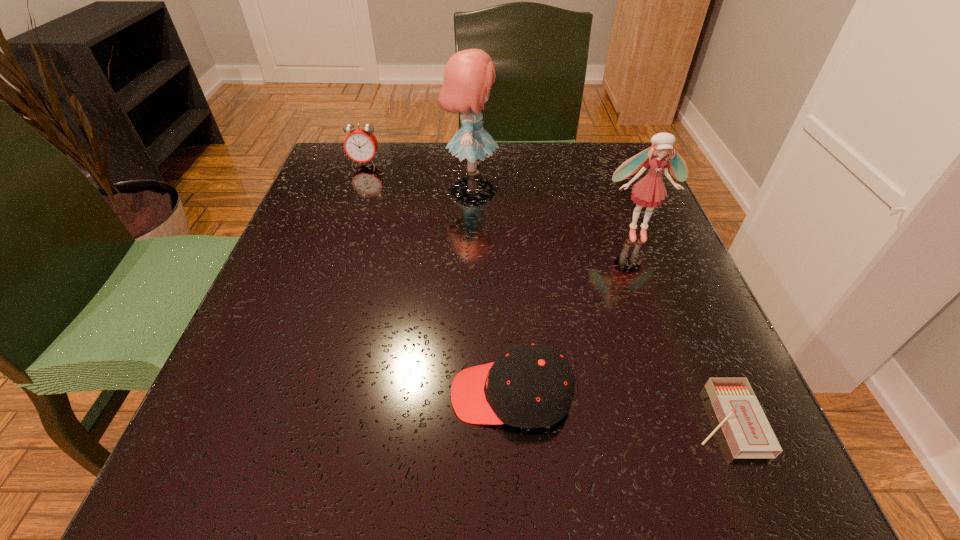
Find the location of a particular element. The width and height of the screenshot is (960, 540). object located in the left edge section of the desktop is located at coordinates (360, 145).

Image resolution: width=960 pixels, height=540 pixels. Identify the location of doll located at the right edge. (650, 191).

You are a GUI agent. You are given a task and a screenshot of the screen. Output one action in this format:
    pyautogui.click(x=<x>, y=<y>)
    Task: Click on the matchbox that is at the right edge
    The width and height of the screenshot is (960, 540).
    Given the screenshot: What is the action you would take?
    [748, 433]

You are a GUI agent. You are given a task and a screenshot of the screen. Output one action in this format:
    pyautogui.click(x=<x>, y=<y>)
    Task: Click on the object present at the far left corner
    This screenshot has height=540, width=960.
    Given the screenshot: What is the action you would take?
    pyautogui.click(x=360, y=145)

Image resolution: width=960 pixels, height=540 pixels. I want to click on object that is at the near right corner, so click(x=748, y=433).

Where is `free space at the far edge`? free space at the far edge is located at coordinates (547, 173).

Locate an element on the screen. Image resolution: width=960 pixels, height=540 pixels. vacant space at the near edge of the desktop is located at coordinates (518, 458).

Find the location of `free space at the left edge of the desktop`. free space at the left edge of the desktop is located at coordinates (317, 204).

Locate an element on the screen. free spot at the right edge of the desktop is located at coordinates (660, 224).

Where is `blank area at the far left corner`? blank area at the far left corner is located at coordinates (370, 177).